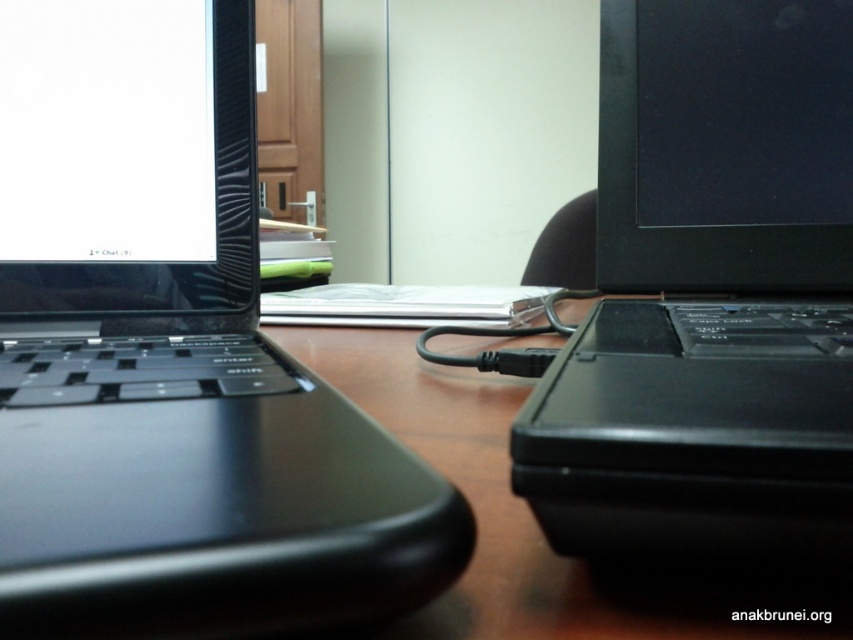
This screenshot has height=640, width=853. I want to click on black matte laptop at left, so click(x=177, y=358).

Is black matte laptop at left thinner than black matte laptop at right?

Correct, black matte laptop at left's width is less than black matte laptop at right's.

Who is more forward, (160, 589) or (821, 129)?

Positioned in front is point (160, 589).

Locate an element on the screen. The width and height of the screenshot is (853, 640). black matte laptop at left is located at coordinates (177, 358).

Does black matte laptop at right have a larger size compared to black plastic table at center?

Yes.

Looking at this image, does black matte laptop at right come in front of black plastic table at center?

Yes, black matte laptop at right is closer to the viewer.

Locate an element on the screen. black matte laptop at right is located at coordinates (709, 292).

You are a GUI agent. You are given a task and a screenshot of the screen. Output one action in this format:
    pyautogui.click(x=<x>, y=<y>)
    Task: Click on the black matte laptop at right
    This screenshot has width=853, height=640.
    Given the screenshot: What is the action you would take?
    tap(709, 292)

Who is more distant from viewer, (198,413) or (814,634)?

Positioned behind is point (198,413).

Is point (312, 432) behind point (619, 582)?

Yes, it is.

Where is `black matte laptop at left`? Image resolution: width=853 pixels, height=640 pixels. black matte laptop at left is located at coordinates (177, 358).